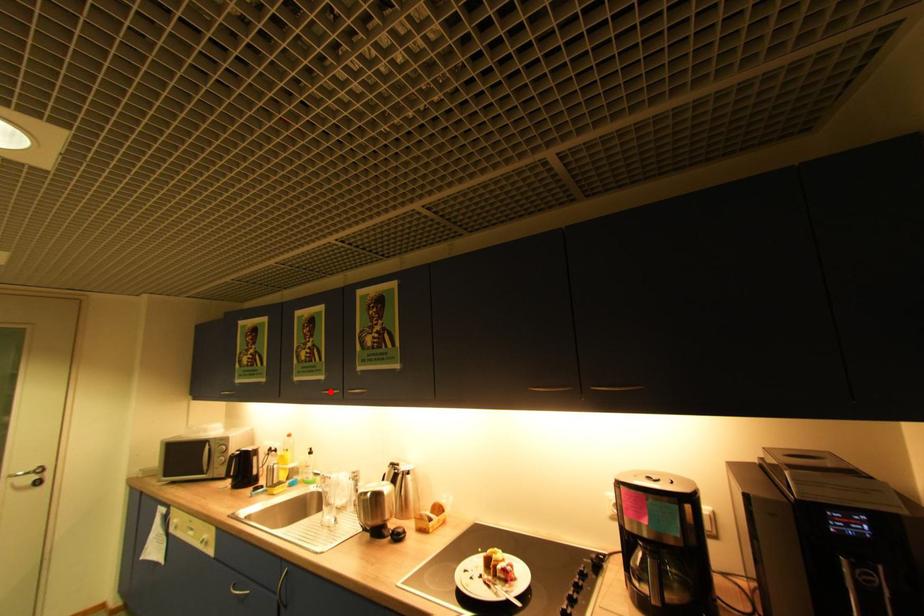
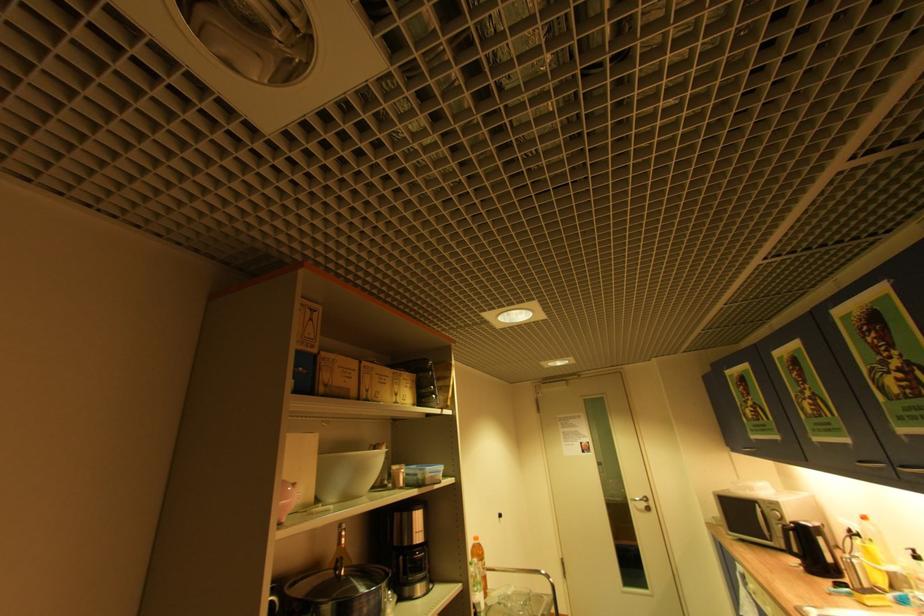
Question: I am providing you with two images of the same scene from different viewpoints. A red point is marked on the first image. At the location where the point appears in image 1, is it still visible in image 2?

Choices:
 (A) Yes
 (B) No

Answer: (A)